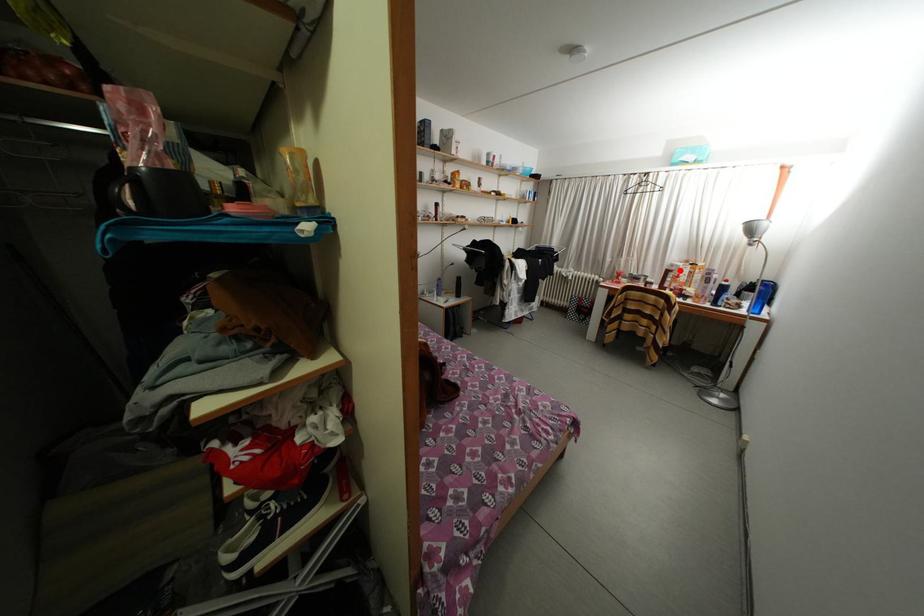
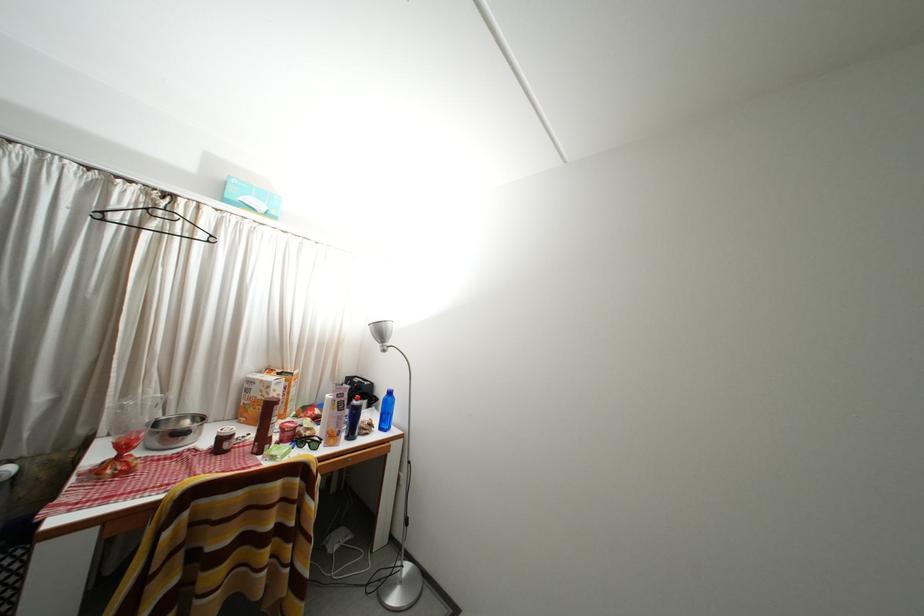
Find the pixel in the second image that matches the highlighted location in the first image.

(259, 387)